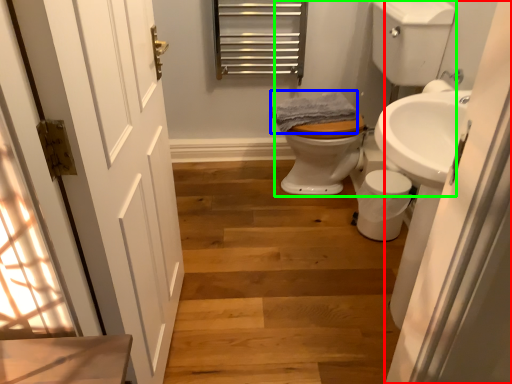
Question: Based on their relative distances, which object is farther from screen door (highlighted by a red box)? Choose from bath towel (highlighted by a blue box) and landing (highlighted by a green box).

Choices:
 (A) bath towel
 (B) landing

Answer: (A)